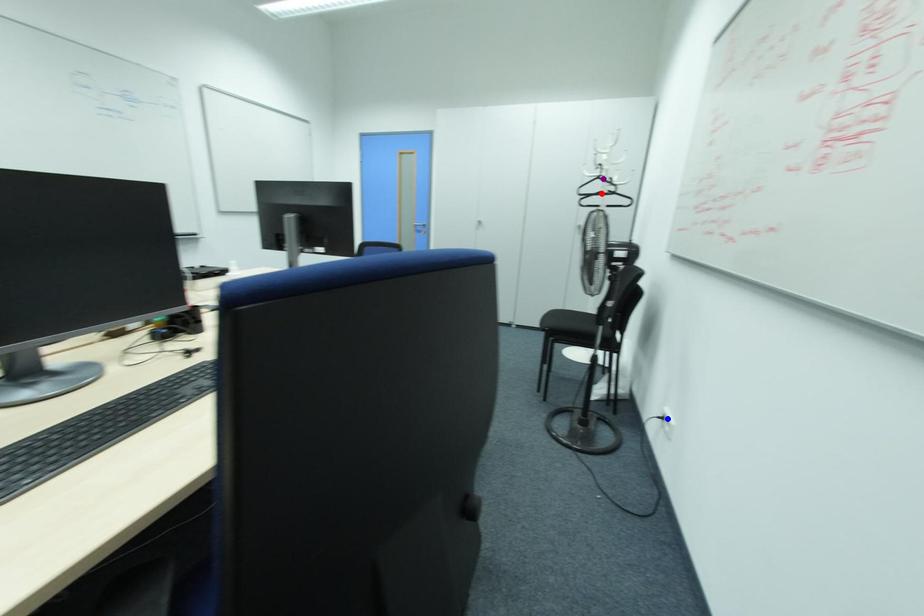
Order these from nearest to farthest:
red point | blue point | purple point

blue point
red point
purple point